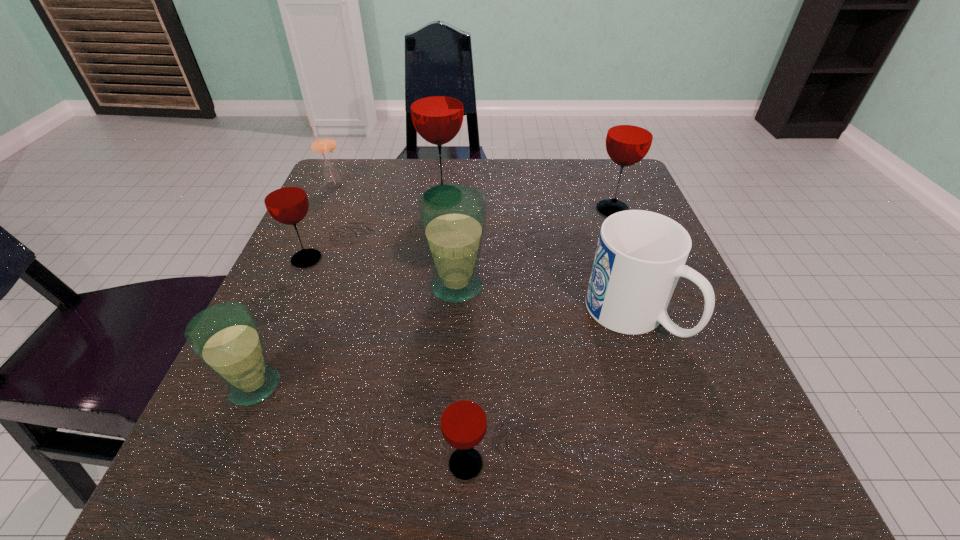
Locate an element on the screen. red glass that stands as the third closest to the tallest glass is located at coordinates (463, 420).

The width and height of the screenshot is (960, 540). Identify the location of vacant area that satisfies the following two spatial constraints: 1. on the front side of the biggest red glass; 2. on the right side of the right blue glass. coord(433,286).

Where is `free point that satisfies the following two spatial constraints: 1. on the front side of the straw; 2. on the right side of the tallest object`? The image size is (960, 540). free point that satisfies the following two spatial constraints: 1. on the front side of the straw; 2. on the right side of the tallest object is located at coordinates (328, 197).

This screenshot has height=540, width=960. Find the location of `vacant point that satisfies the following two spatial constraints: 1. on the back side of the rightmost red glass; 2. on the right side of the bigger blue glass`. vacant point that satisfies the following two spatial constraints: 1. on the back side of the rightmost red glass; 2. on the right side of the bigger blue glass is located at coordinates (461, 210).